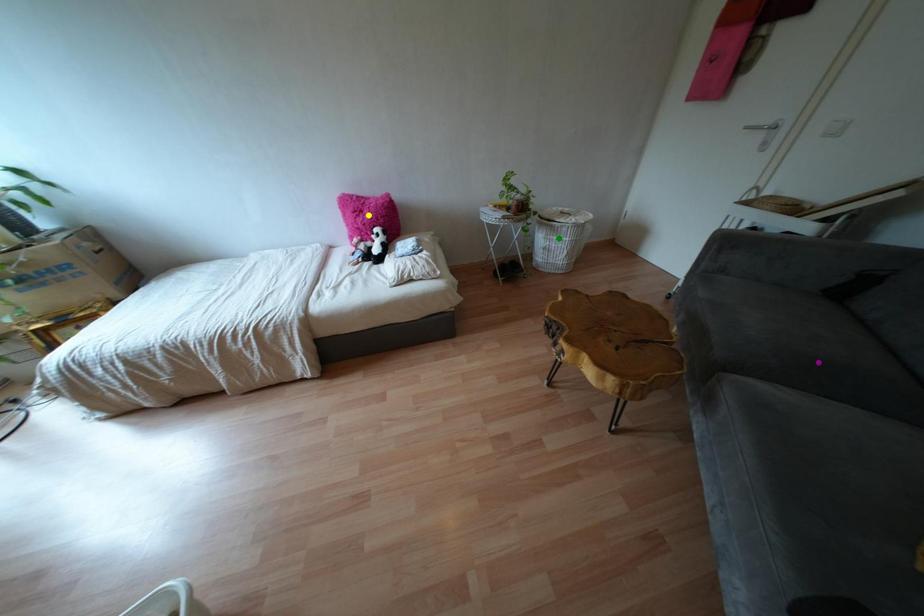
Consider the image. Order these from nearest to farthest:
yellow point, purple point, green point

purple point, yellow point, green point